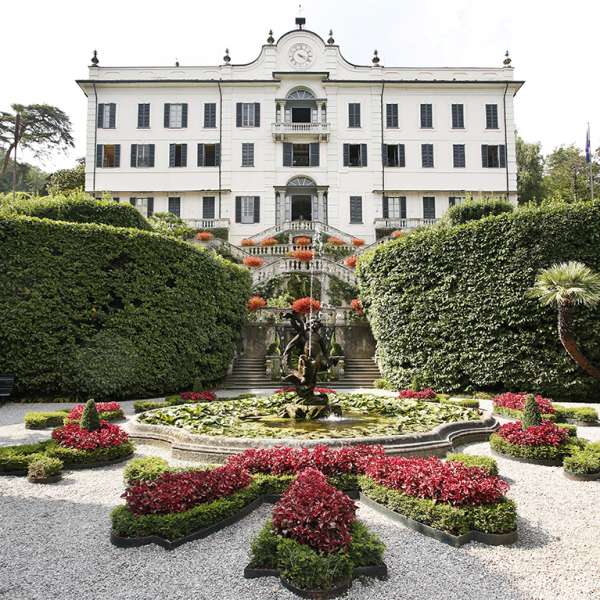
Where is `doors`? Image resolution: width=600 pixels, height=600 pixels. doors is located at coordinates point(300,205), point(300,113).